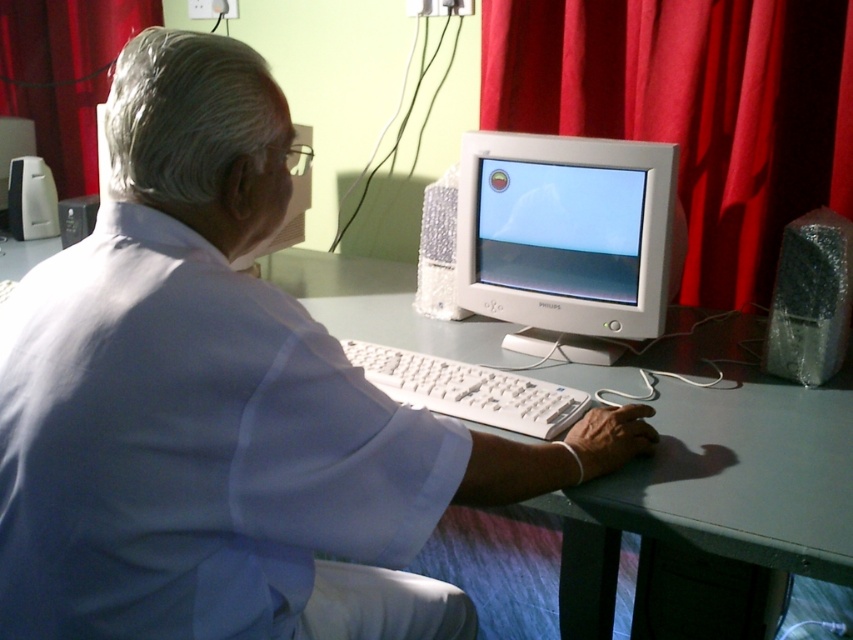
You are an interior designer planning to place a new shelf between the matte plastic monitor at center and the red fabric curtain at upper left. Based on their thickness, which object would require more space in the depth direction?

The red fabric curtain at upper left requires more space in the depth direction because it is thicker than the matte plastic monitor at center.

You are a technician asked to replace the matte plastic monitor at center. To access it, you need to move the red fabric curtain at upper left first. Is the monitor located below the curtain?

Yes, the matte plastic monitor at center is positioned under the red fabric curtain at upper left, so moving the curtain would allow access to the monitor.